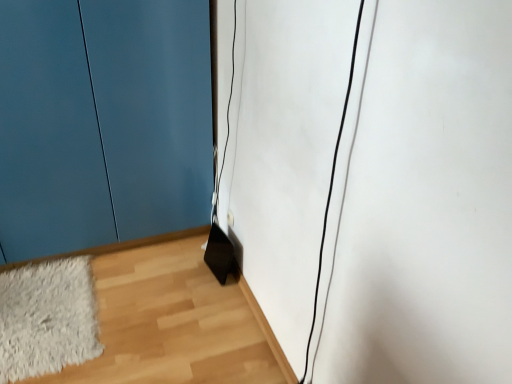
Identify the location of free space below white fluffy rug at lower left (from a real-world perspective). The width and height of the screenshot is (512, 384). (45, 302).